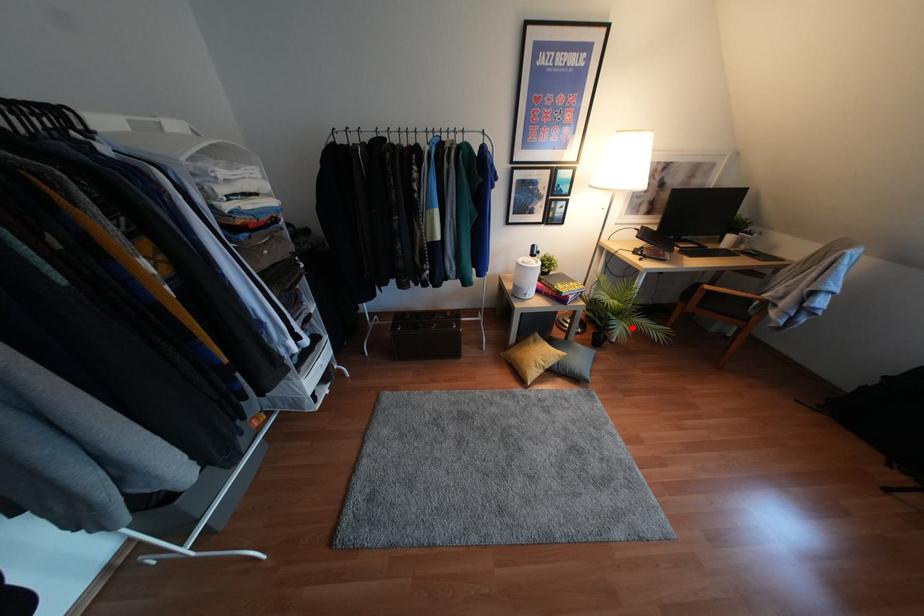
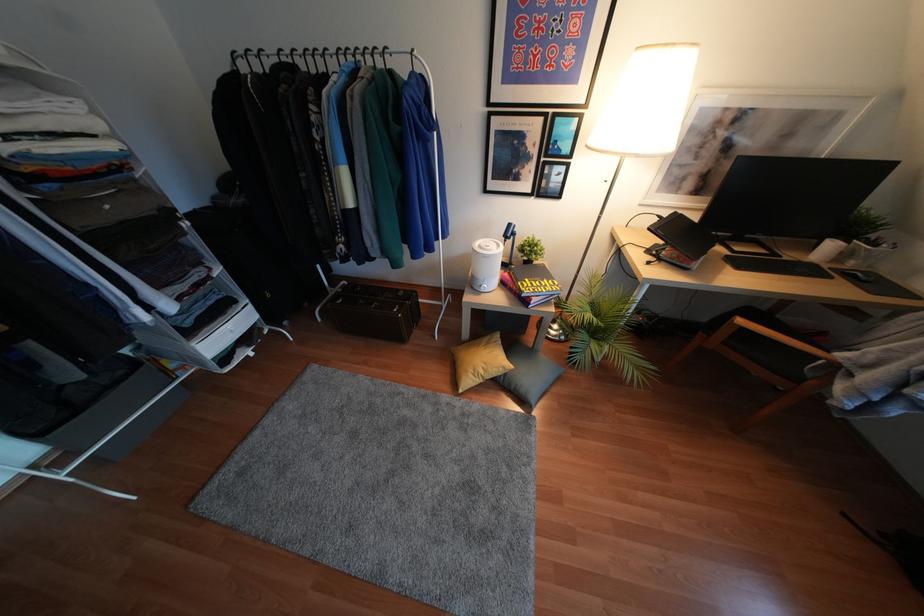
Question: I am providing you with two images of the same scene from different viewpoints. In image1, a red point is highlighted. Considering the same 3D point in image2, which of the following is correct?

Choices:
 (A) It is closer
 (B) It is farther

Answer: (B)